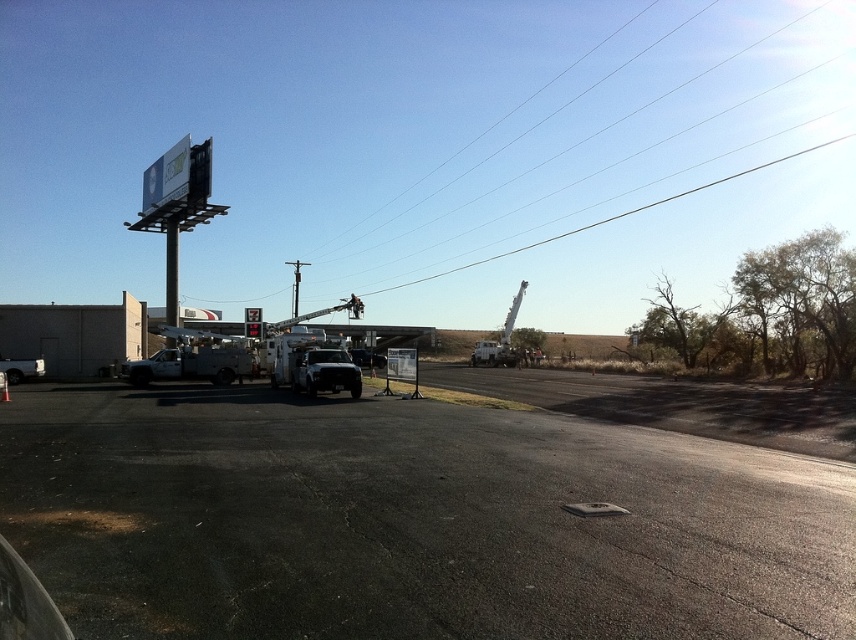
You are a delivery driver who needs to park your truck, which is 2 meters wide, in the parking lot. There is a white matte utility truck at center and a brushed metal pole at left. Can your truck fit between them without touching either?

The white matte utility truck at center is narrower than the brushed metal pole at left. Since your truck is 2 meters wide, you need to check the space between them. However, without knowing the exact distance between the two objects, it is impossible to determine if your truck can fit safely. Please measure the gap before attempting to park.

You are standing at the point marked by the coordinates point (x=192, y=364) in the image. Looking around, you see a white matte utility truck at left. Is the white matte utility truck at left located to your left or right side?

The point (x=192, y=364) indicates the white matte utility truck at left, so the white matte utility truck at left is located to your left side.